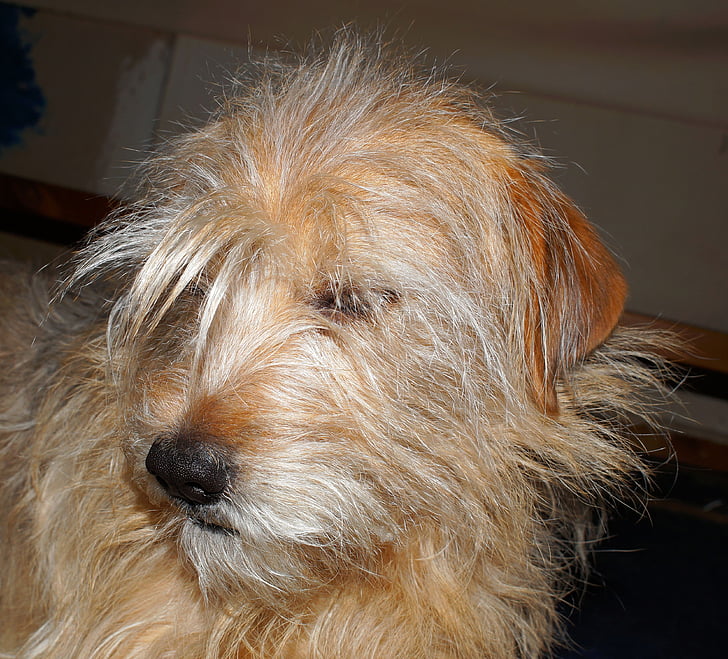
This screenshot has width=728, height=659. Identify the location of baseboard. (49, 206).